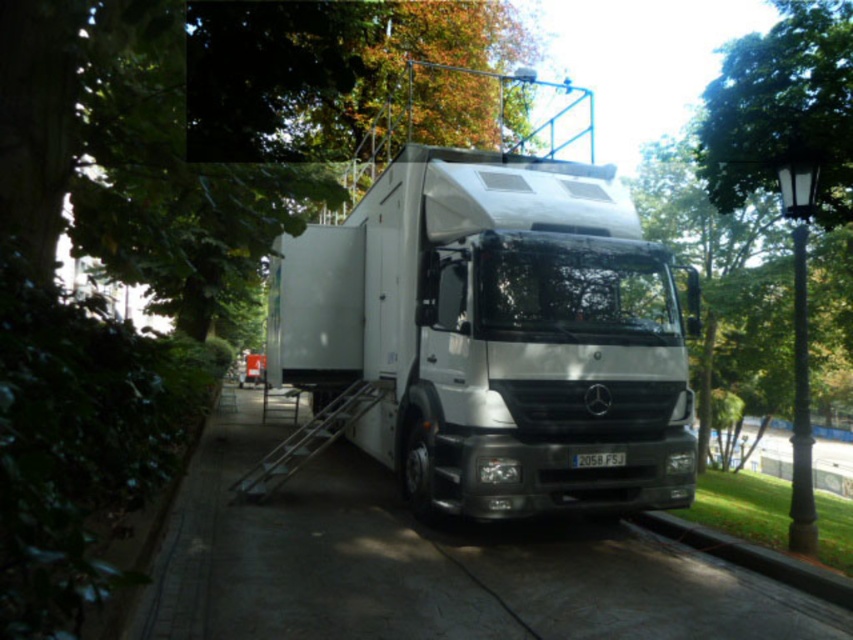
Question: Observing the image, what is the correct spatial positioning of white metallic truck at center in reference to paved concrete sidewalk at center?

Choices:
 (A) left
 (B) right

Answer: (B)

Question: Which of the following is the farthest from the observer?

Choices:
 (A) (486, 397)
 (B) (370, 484)

Answer: (B)

Question: Does white metallic truck at center have a larger size compared to paved concrete sidewalk at center?

Choices:
 (A) no
 (B) yes

Answer: (A)

Question: Does white metallic truck at center have a greater width compared to paved concrete sidewalk at center?

Choices:
 (A) no
 (B) yes

Answer: (A)